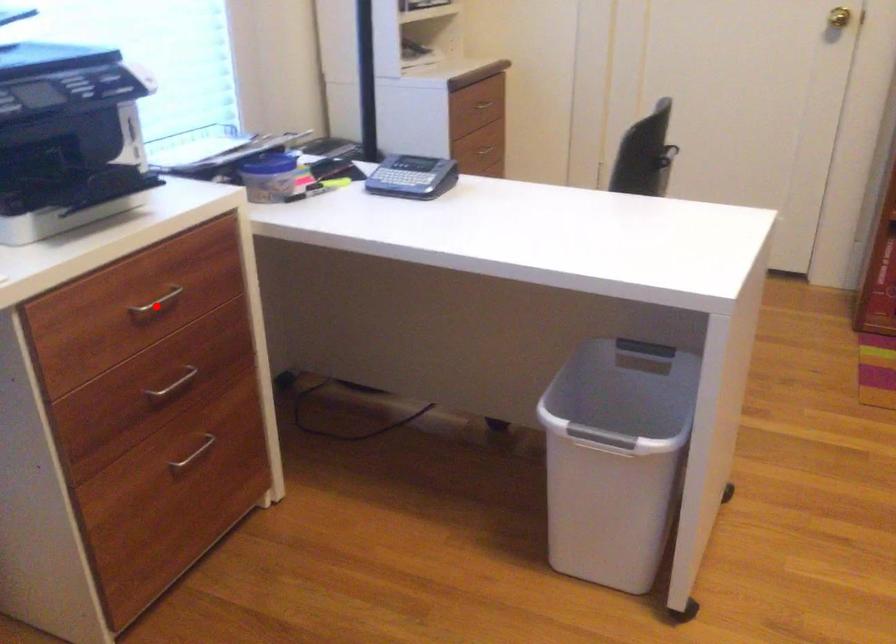
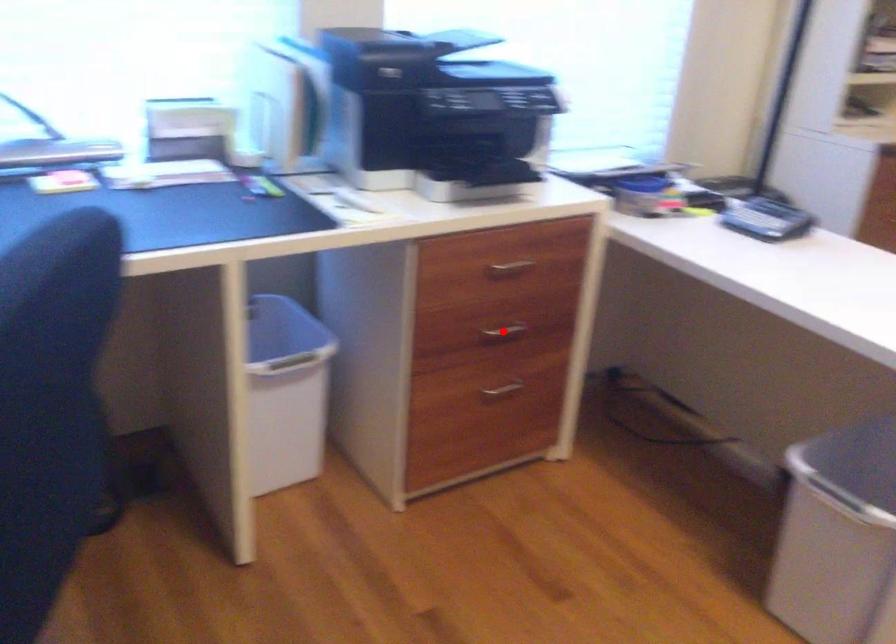
I am providing you with two images of the same scene from different viewpoints. A red point is marked on the first image and another point is marked on the second image. Does the point marked in image1 correspond to the same location as the one in image2?

No